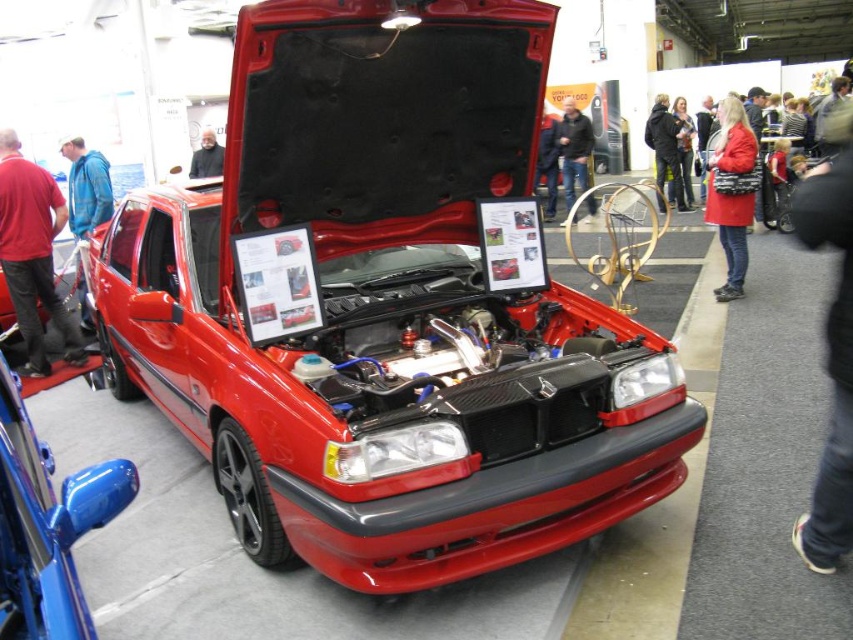
You are a photographer at the car exhibition. You want to take a photo of the shiny red car at center and the black leather jacket at upper center so that both are visible in the frame. Based on their positions, which object should you place on the left side of your camera frame to ensure both are included?

The shiny red car at center is positioned on the left side of black leather jacket at upper center, so you should place the shiny red car at center on the left side of your camera frame to ensure both are included.

You are a photographer at the exhibition and want to capture a clear shot of the black leather jacket at upper center and the blonde hair at center. Which object is narrower so that it won not block the other when framing the shot?

The black leather jacket at upper center is thinner than blonde hair at center, so it will not block the blonde hair at center when framing the shot.